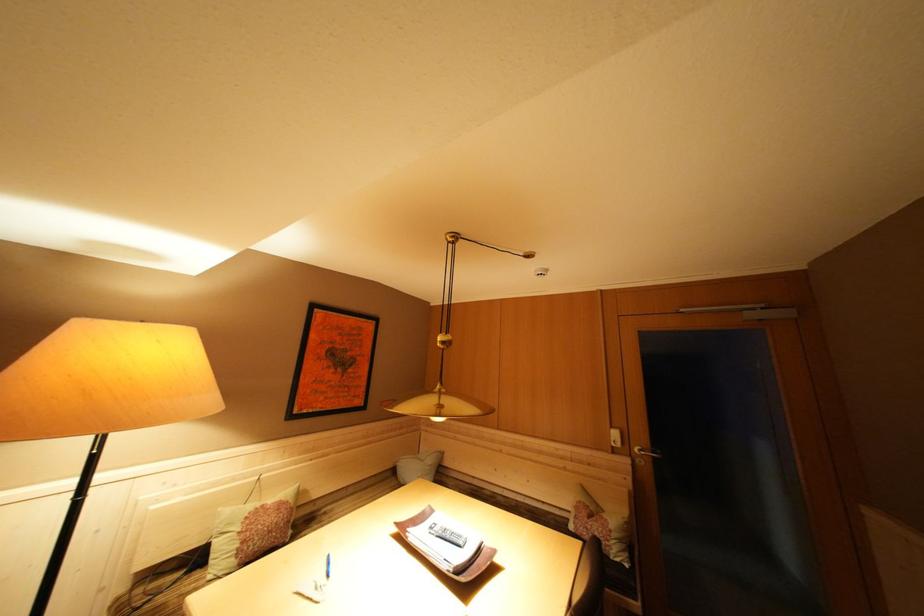
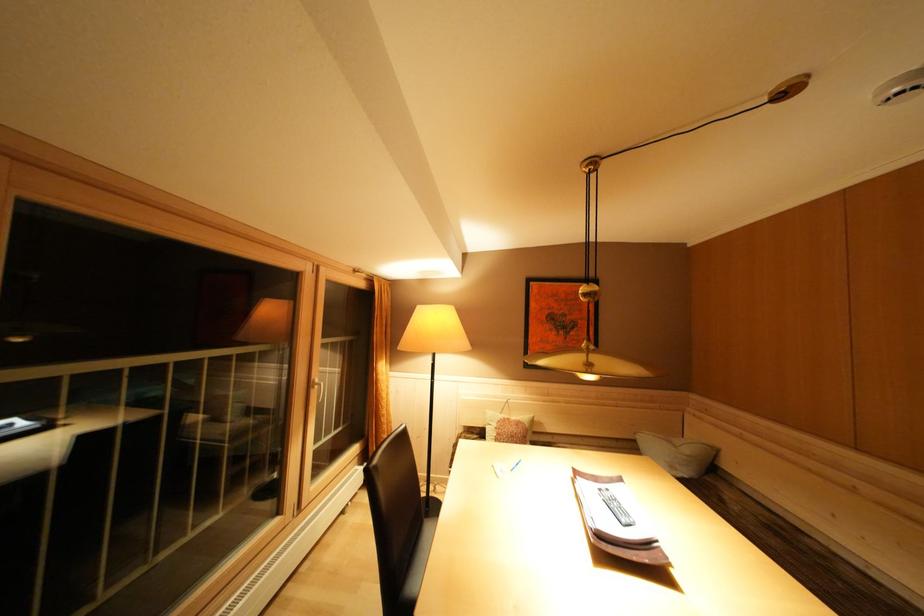
Where in the second image is the point corresponding to (x=438, y=466) from the first image?

(695, 456)